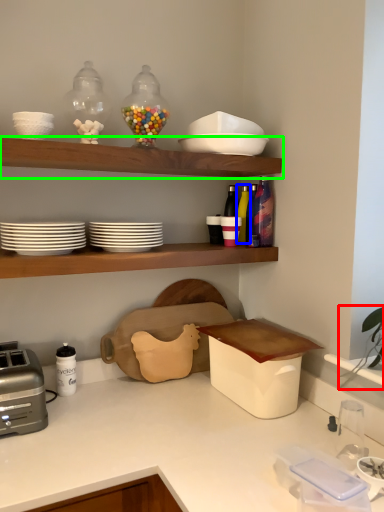
Question: Which is farther away from plant (highlighted by a red box)? bottle (highlighted by a blue box) or shelf (highlighted by a green box)?

Choices:
 (A) bottle
 (B) shelf

Answer: (B)